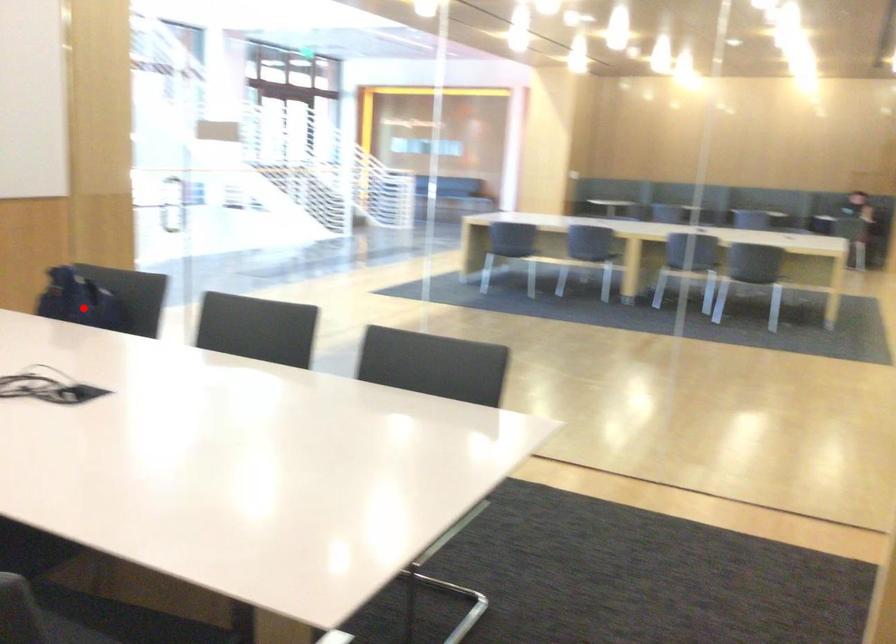
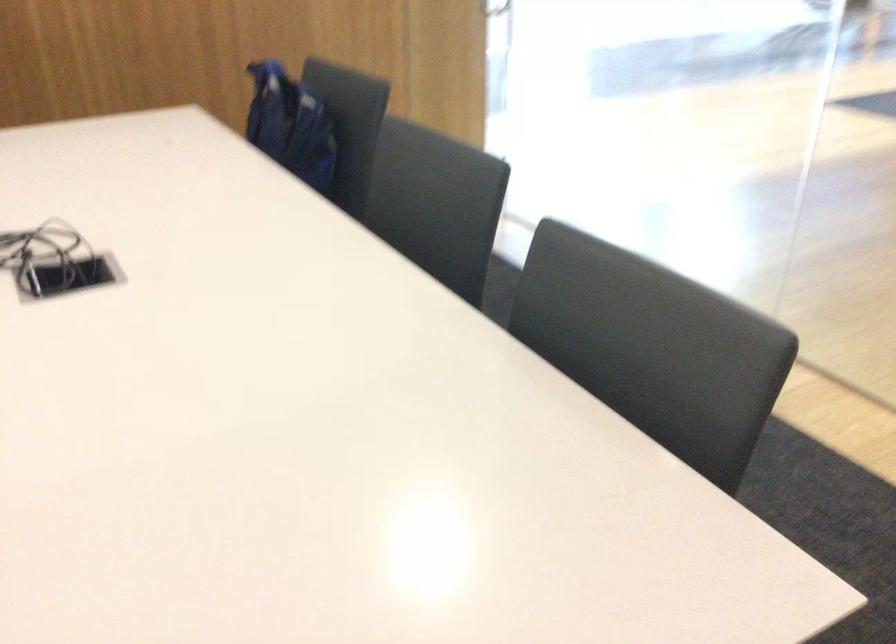
Where in the second image is the point corresponding to the highlighted location from the first image?

(289, 125)